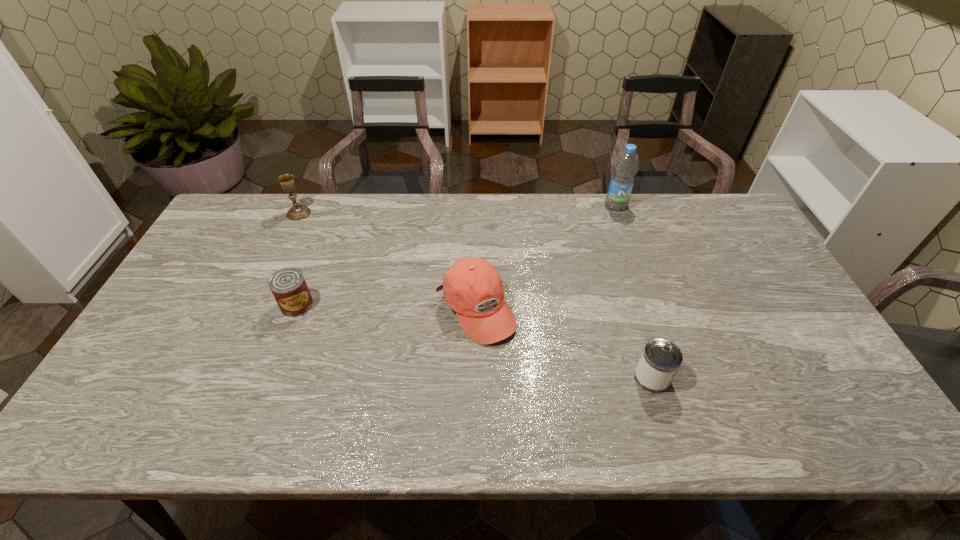
Locate an element on the screen. This screenshot has height=540, width=960. vacant space situated on the right of the fourth object from right to left is located at coordinates (409, 306).

Where is `free space located on the back of the nearer can`? This screenshot has height=540, width=960. free space located on the back of the nearer can is located at coordinates (631, 310).

Locate an element on the screen. water bottle that is at the far edge is located at coordinates (626, 166).

In order to click on chalice that is positioned at the far edge in this screenshot , I will do `click(296, 212)`.

In order to click on free space at the far edge of the desktop in this screenshot , I will do `click(290, 208)`.

The image size is (960, 540). Identify the location of free location at the near edge of the desktop. (496, 421).

Image resolution: width=960 pixels, height=540 pixels. I want to click on vacant space at the right edge of the desktop, so click(779, 325).

In order to click on vacant area at the far left corner of the desktop in this screenshot , I will do `click(266, 201)`.

You are a GUI agent. You are given a task and a screenshot of the screen. Output one action in this format:
    pyautogui.click(x=<x>, y=<y>)
    Task: Click on the blank area at the far right corner
    This screenshot has width=960, height=540.
    Given the screenshot: What is the action you would take?
    coord(697,201)

In the image, there is a desktop. Where is `vacant region at the near right corner`? The height and width of the screenshot is (540, 960). vacant region at the near right corner is located at coordinates (868, 433).